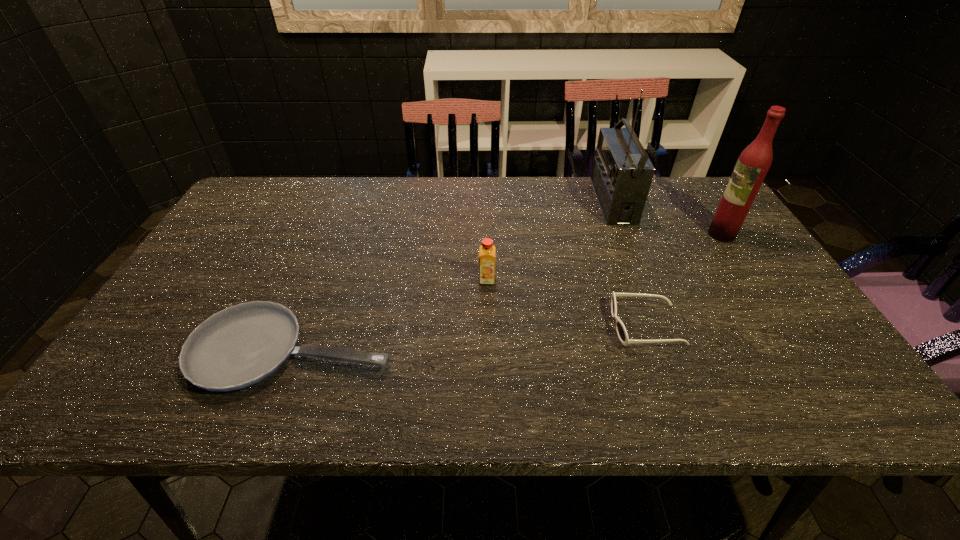
Identify the location of free space located on the front panel of the radio receiver. Image resolution: width=960 pixels, height=540 pixels. (578, 201).

Locate an element on the screen. The width and height of the screenshot is (960, 540). vacant region located on the label of the fourth nearest object is located at coordinates (684, 234).

The width and height of the screenshot is (960, 540). Find the location of `vacant area situated on the label of the fourth nearest object`. vacant area situated on the label of the fourth nearest object is located at coordinates (642, 234).

I want to click on vacant space located 0.380m on the label of the fourth nearest object, so click(x=576, y=234).

Find the location of a particular element. The width and height of the screenshot is (960, 540). vacant space located 0.250m on the front and back of the second object from left to right is located at coordinates (489, 368).

The width and height of the screenshot is (960, 540). What are the coordinates of `vacant area situated with the lenses of the sunglasses facing outward` in the screenshot? It's located at (573, 326).

Where is `vacant point located with the lenses of the sunglasses facing outward`? This screenshot has height=540, width=960. vacant point located with the lenses of the sunglasses facing outward is located at coordinates (556, 326).

Identify the location of free space located 0.050m with the lenses of the sunglasses facing outward. Image resolution: width=960 pixels, height=540 pixels. coord(590,326).

Identify the location of vacant space located 0.200m on the right of the shortest object. The width and height of the screenshot is (960, 540). (486, 350).

Locate an element on the screen. The height and width of the screenshot is (540, 960). object located at the far edge is located at coordinates (622, 173).